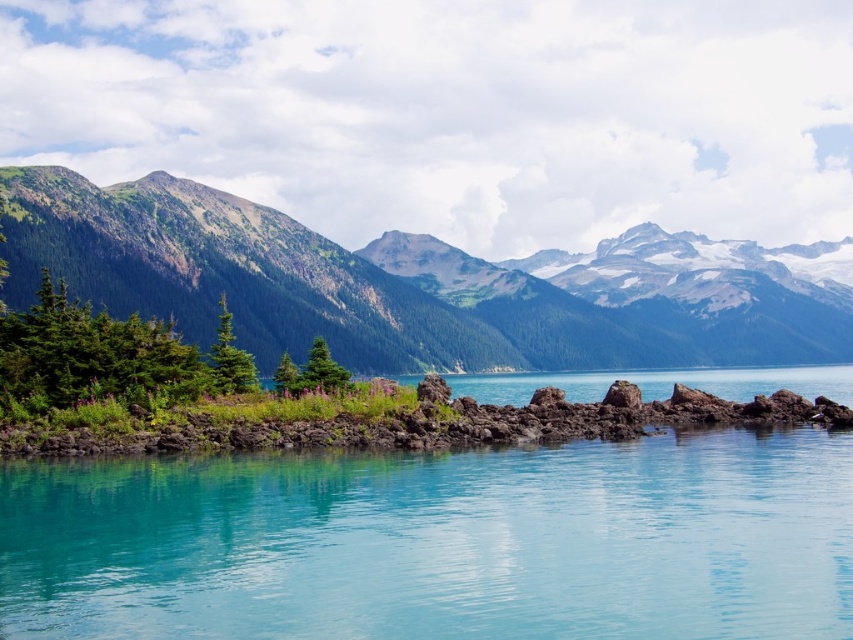
You are standing on the shore and see the turquoise glossy water at center and the green rocky mountain at left. Which object is closer to your right side?

The green rocky mountain at left is closer to your right side because the turquoise glossy water at center is positioned on the left side of it.

You are standing at the edge of the scene and want to reach the green rocky mountain at left. Which direction should you move to get closer to it without crossing the turquoise glossy water at center?

You should move to the left away from the turquoise glossy water at center to approach the green rocky mountain at left.